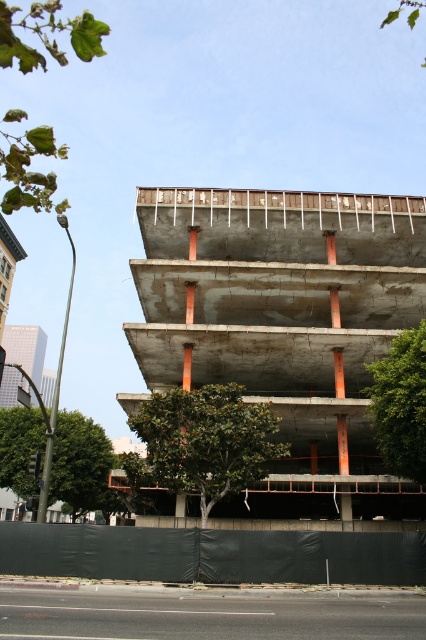
Is green leafy tree at lower left wider than green leafy tree at right?

Yes.

Between green leafy tree at lower left and green leafy tree at right, which one has less height?

green leafy tree at right

Identify the location of green leafy tree at lower left. (80, 465).

Who is more distant from viewer, [161,420] or [77,36]?

The point [161,420] is more distant.

How much distance is there between green leafy tree at center and green leafy tree at upper left?

17.33 meters

Is point (175, 477) positioned behind point (17, 136)?

That is False.

What are the coordinates of `green leafy tree at center` in the screenshot? It's located at (203, 442).

Is point (154, 456) positioned before point (23, 474)?

Yes, point (154, 456) is in front of point (23, 474).

Between green leafy tree at center and green leafy tree at lower left, which one is positioned higher?

green leafy tree at center is higher up.

Between point (219, 480) and point (75, 481), which one is positioned behind?

Positioned behind is point (75, 481).

The width and height of the screenshot is (426, 640). What are the coordinates of `green leafy tree at center` in the screenshot? It's located at (203, 442).